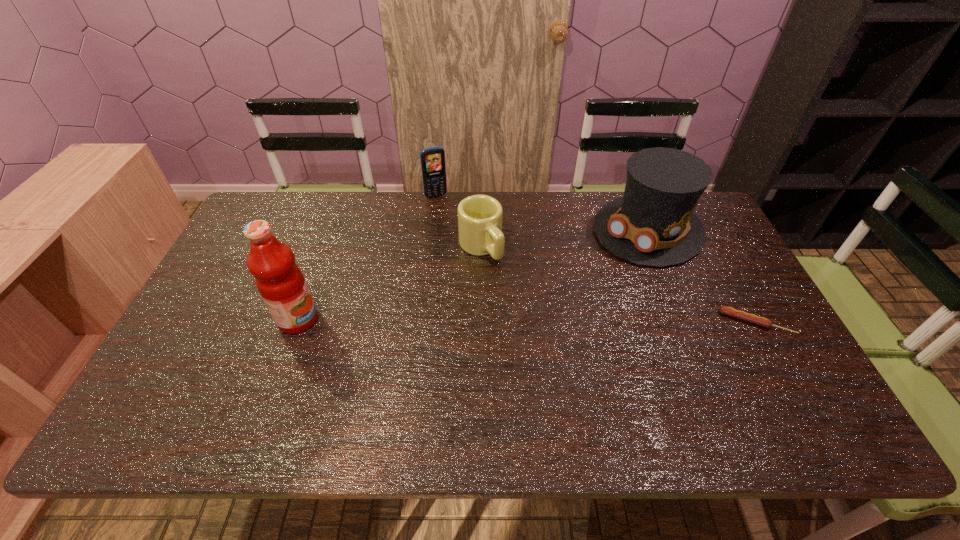
Where is `object that stands as the second closest to the fourth shortest object`? Image resolution: width=960 pixels, height=540 pixels. object that stands as the second closest to the fourth shortest object is located at coordinates (480, 233).

You are a GUI agent. You are given a task and a screenshot of the screen. Output one action in this format:
    pyautogui.click(x=<x>, y=<y>)
    Task: Click on the vacant position in the image that satisfies the following two spatial constraints: 1. on the front side of the second tallest object; 2. on the right side of the third shortest object
    This screenshot has height=540, width=960.
    Given the screenshot: What is the action you would take?
    pyautogui.click(x=432, y=230)